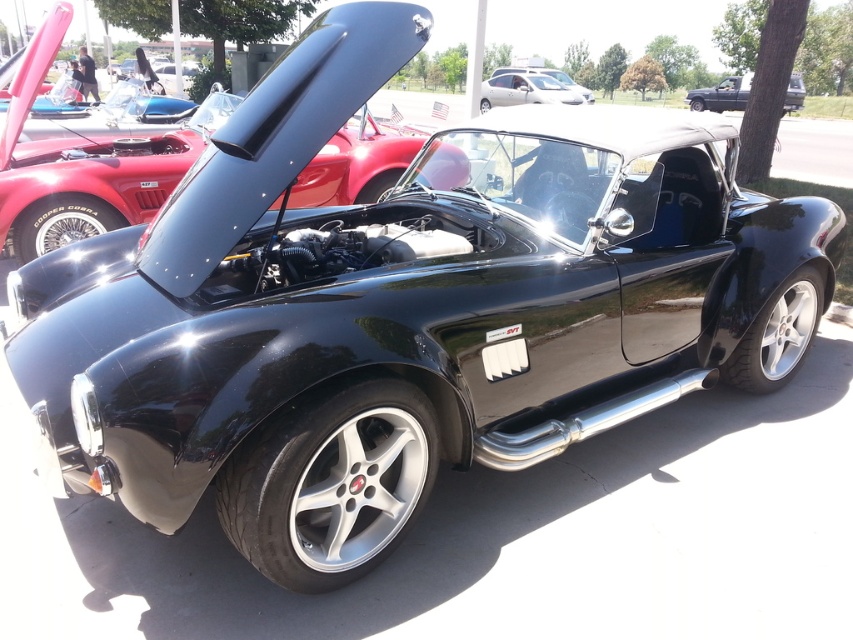
Question: Can you confirm if satin silver car at upper center is positioned to the right of matte black car at upper right?

Choices:
 (A) yes
 (B) no

Answer: (B)

Question: In this image, where is satin silver car at upper center located relative to matte black car at upper right?

Choices:
 (A) left
 (B) right

Answer: (A)

Question: Which point is farther to the camera?

Choices:
 (A) satin silver car at upper center
 (B) matte black car at upper right

Answer: (A)

Question: Among these points, which one is nearest to the camera?

Choices:
 (A) (735, 104)
 (B) (560, 92)

Answer: (B)

Question: Which of the following is the farthest from the observer?

Choices:
 (A) matte black car at upper right
 (B) satin silver car at upper center

Answer: (B)

Question: Is satin silver car at upper center bigger than matte black car at upper right?

Choices:
 (A) no
 (B) yes

Answer: (A)